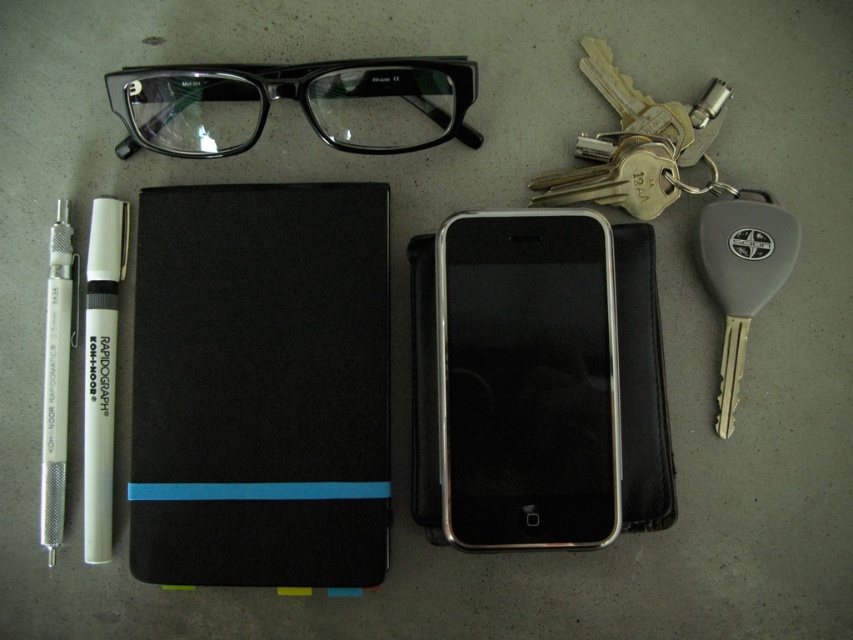
Is the position of transparent plastic glasses at top less distant than that of white matte pen at left?

Yes, it is.

Based on the photo, can you confirm if transparent plastic glasses at top is positioned to the left of white matte pen at left?

In fact, transparent plastic glasses at top is to the right of white matte pen at left.

This screenshot has height=640, width=853. What are the coordinates of `transparent plastic glasses at top` in the screenshot? It's located at (299, 104).

You are a GUI agent. You are given a task and a screenshot of the screen. Output one action in this format:
    pyautogui.click(x=<x>, y=<y>)
    Task: Click on the transparent plastic glasses at top
    The width and height of the screenshot is (853, 640).
    Given the screenshot: What is the action you would take?
    pyautogui.click(x=299, y=104)

Does silver metallic smartphone at center have a lesser width compared to transparent plastic glasses at top?

Yes, silver metallic smartphone at center is thinner than transparent plastic glasses at top.

Which of these two, silver metallic smartphone at center or transparent plastic glasses at top, stands shorter?

transparent plastic glasses at top

The width and height of the screenshot is (853, 640). In order to click on silver metallic smartphone at center in this screenshot , I will do `click(527, 380)`.

You are a GUI agent. You are given a task and a screenshot of the screen. Output one action in this format:
    pyautogui.click(x=<x>, y=<y>)
    Task: Click on the silver metallic smartphone at center
    
    Given the screenshot: What is the action you would take?
    pyautogui.click(x=527, y=380)

Is black matte notebook at center wider than transparent plastic glasses at top?

No.

Who is positioned more to the left, black matte notebook at center or transparent plastic glasses at top?

black matte notebook at center is more to the left.

Is point (299, 534) farther from camera compared to point (409, 134)?

That is False.

Image resolution: width=853 pixels, height=640 pixels. In order to click on black matte notebook at center in this screenshot , I will do pyautogui.click(x=260, y=385).